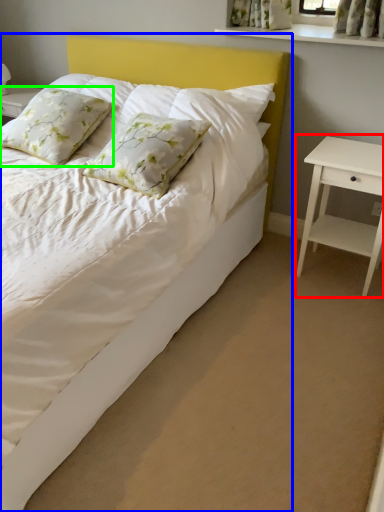
Question: Based on their relative distances, which object is farther from nightstand (highlighted by a red box)? Choose from bed (highlighted by a blue box) and pillow (highlighted by a green box).

Choices:
 (A) bed
 (B) pillow

Answer: (B)